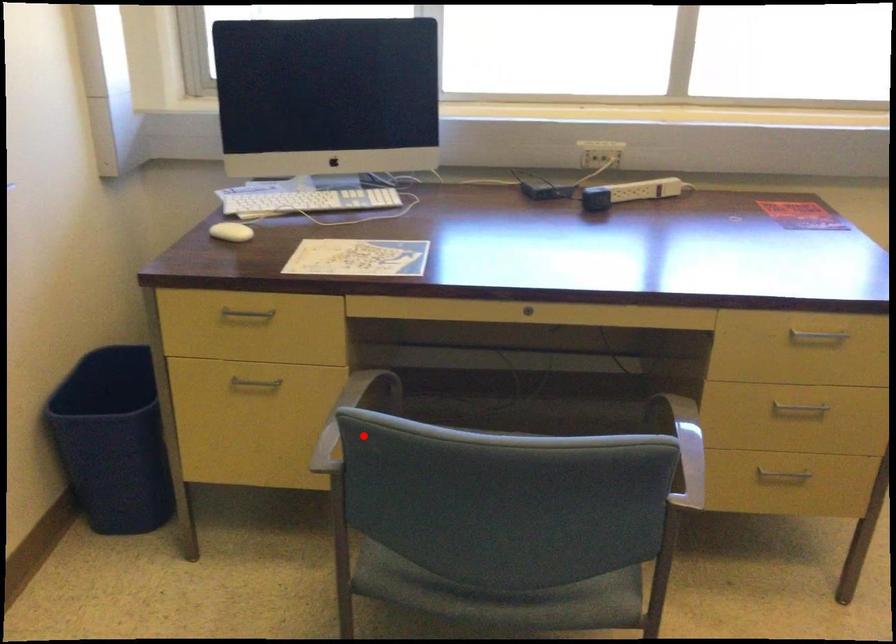
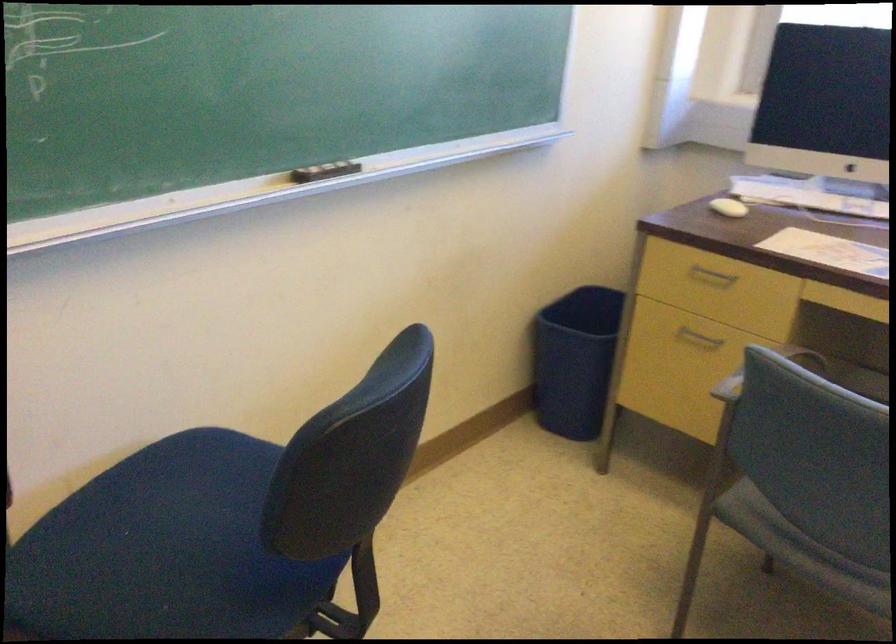
Locate, in the second image, the point that corresponds to the highlighted location in the first image.

(764, 371)